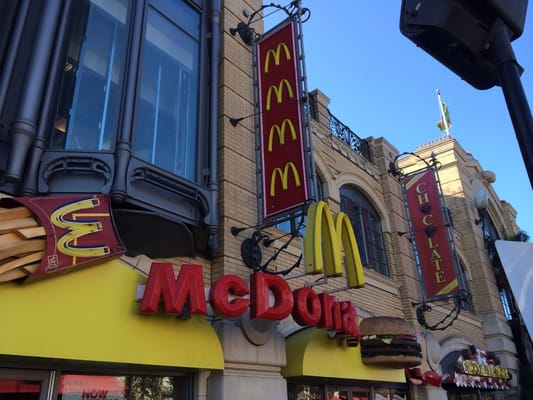
Identify the location of bottom left corner empty space. The width and height of the screenshot is (533, 400). (2, 396).